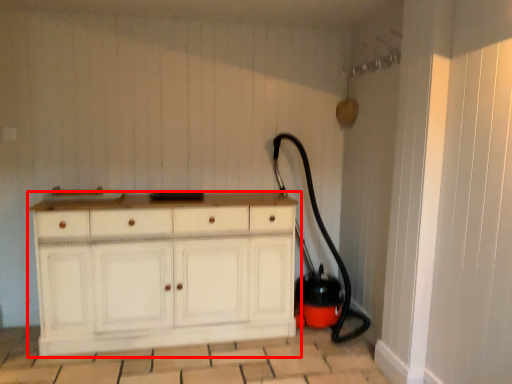
Question: In this image, where is chest of drawers (annotated by the red box) located relative to garden hose?

Choices:
 (A) left
 (B) right

Answer: (A)